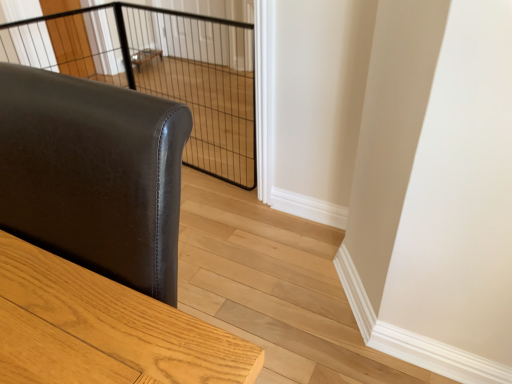
Question: Considering the positions of black wire mesh cage at upper center and matte black leather sofa at left in the image, is black wire mesh cage at upper center bigger or smaller than matte black leather sofa at left?

Choices:
 (A) big
 (B) small

Answer: (B)

Question: Is black wire mesh cage at upper center spatially inside matte black leather sofa at left, or outside of it?

Choices:
 (A) inside
 (B) outside

Answer: (B)

Question: Estimate the real-world distances between objects in this image. Which object is farther from the black wire mesh cage at upper center?

Choices:
 (A) clear wire mesh at upper left, which ranks as the first screen door in left-to-right order
 (B) matte black leather sofa at left
 (C) clear glass screen door at upper center, marked as the 2th screen door in a left-to-right arrangement

Answer: (B)

Question: Based on their relative distances, which object is farther from the matte black leather sofa at left?

Choices:
 (A) black wire mesh cage at upper center
 (B) clear glass screen door at upper center, which is the 1th screen door in right-to-left order
 (C) clear wire mesh at upper left, marked as the 2th screen door in a right-to-left arrangement

Answer: (B)